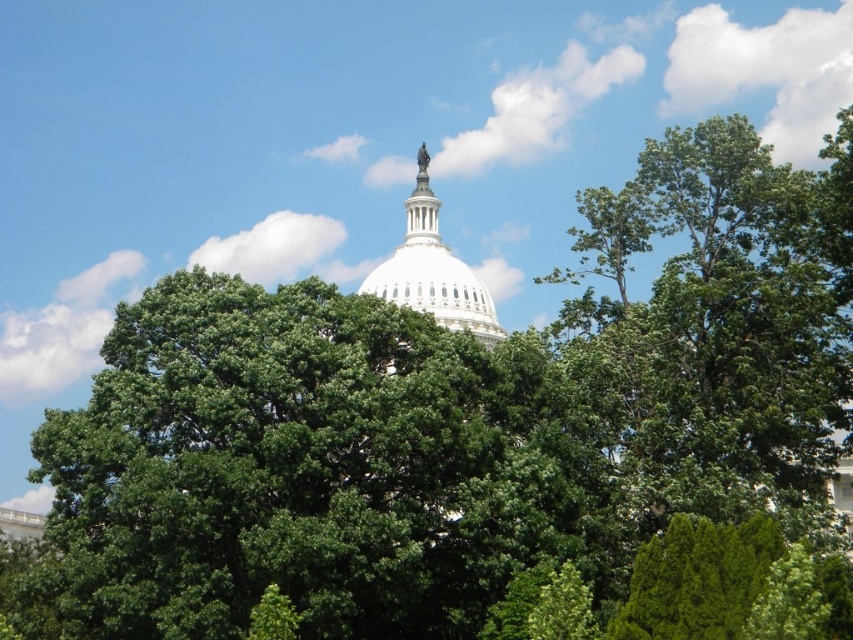
Question: Does green leafy tree at upper right appear on the right side of white marble dome at center?

Choices:
 (A) yes
 (B) no

Answer: (A)

Question: Among these points, which one is nearest to the camera?

Choices:
 (A) (786, 326)
 (B) (428, 250)

Answer: (A)

Question: Which point is farther to the camera?

Choices:
 (A) white marble dome at center
 (B) green leafy tree at upper right

Answer: (A)

Question: Can you confirm if green leafy tree at upper right is positioned below white marble dome at center?

Choices:
 (A) yes
 (B) no

Answer: (B)

Question: Can you confirm if green leafy tree at upper right is positioned above white marble dome at center?

Choices:
 (A) yes
 (B) no

Answer: (A)

Question: Which of the following is the closest to the observer?

Choices:
 (A) white marble dome at center
 (B) green leafy tree at upper right

Answer: (B)